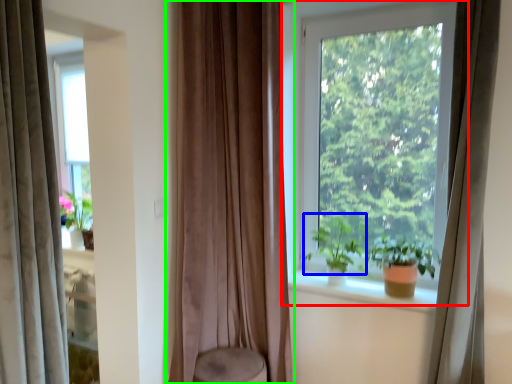
Question: Estimate the real-world distances between objects in this image. Which object is farther from window (highlighted by a red box), vegetation (highlighted by a blue box) or curtain (highlighted by a green box)?

Choices:
 (A) vegetation
 (B) curtain

Answer: (B)